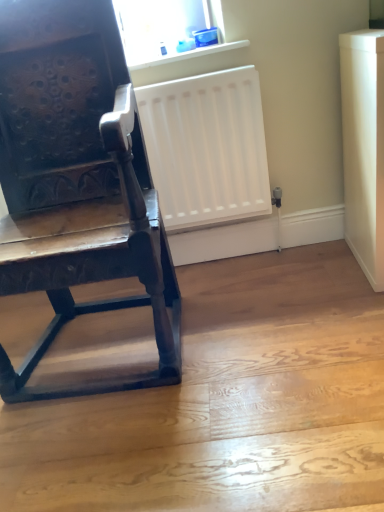
Describe the element at coordinates (190, 54) in the screenshot. I see `white plastic window sill at upper center` at that location.

Where is `white plastic window sill at upper center`? white plastic window sill at upper center is located at coordinates (190, 54).

At what (x,y) coordinates should I click in order to perform the action: click on dark wood chair at left. Please return your answer as a coordinate pair (x, y). Looking at the image, I should click on (77, 181).

This screenshot has width=384, height=512. I want to click on transparent plastic container at upper center, so click(x=164, y=26).

Is the depth of white plastic window sill at upper center greater than that of transparent plastic container at upper center?

Yes, white plastic window sill at upper center is further from the viewer.

Is white plastic window sill at upper center situated inside transparent plastic container at upper center or outside?

The correct answer is: outside.

Is white plastic window sill at upper center placed right next to transparent plastic container at upper center?

No.

Would you say white plastic window sill at upper center is to the left or to the right of transparent plastic container at upper center in the picture?

Clearly, white plastic window sill at upper center is on the right of transparent plastic container at upper center in the image.

Does point (18, 58) appear closer or farther from the camera than point (218, 13)?

Point (18, 58) appears to be closer to the viewer than point (218, 13).

From the image's perspective, is dark wood chair at left under transparent plastic container at upper center?

Yes.

Consider the image. How different are the orientations of dark wood chair at left and transparent plastic container at upper center in degrees?

They differ by 4.69 degrees in their facing directions.

In the scene shown: Is dark wood chair at left positioned behind transparent plastic container at upper center?

No, dark wood chair at left is in front of transparent plastic container at upper center.

Is transparent plastic container at upper center looking in the opposite direction of dark wood chair at left?

No.

Which is nearer, (146, 57) or (101, 51)?

Point (146, 57) is positioned farther from the camera compared to point (101, 51).

Considering the relative sizes of transparent plastic container at upper center and dark wood chair at left in the image provided, is transparent plastic container at upper center smaller than dark wood chair at left?

Indeed, transparent plastic container at upper center has a smaller size compared to dark wood chair at left.

Would you say white plastic window sill at upper center is a long distance from dark wood chair at left?

white plastic window sill at upper center is actually quite close to dark wood chair at left.

Consider the image. Choose the correct answer: Is white plastic window sill at upper center inside dark wood chair at left or outside it?

white plastic window sill at upper center is located beyond the bounds of dark wood chair at left.

From the image's perspective, which is above, white plastic window sill at upper center or dark wood chair at left?

white plastic window sill at upper center.

Is dark wood chair at left in front of or behind white plastic window sill at upper center in the image?

In the image, dark wood chair at left appears in front of white plastic window sill at upper center.

Who is shorter, dark wood chair at left or white plastic window sill at upper center?

With less height is white plastic window sill at upper center.

Is dark wood chair at left at the left side of white plastic window sill at upper center?

Yes.

Based on the photo, does transparent plastic container at upper center turn towards white plastic window sill at upper center?

No, transparent plastic container at upper center is not turned towards white plastic window sill at upper center.

Considering the points (145, 27) and (173, 58), which point is in front, point (145, 27) or point (173, 58)?

The point (173, 58) is in front.

Considering their positions, is transparent plastic container at upper center located in front of or behind white plastic window sill at upper center?

In the image, transparent plastic container at upper center appears in front of white plastic window sill at upper center.

From a real-world perspective, is transparent plastic container at upper center located higher than white plastic window sill at upper center?

Yes.

Locate an element on the screen. The height and width of the screenshot is (512, 384). window sill that is on the right side of transparent plastic container at upper center is located at coordinates (190, 54).

The image size is (384, 512). I want to click on window screen above the dark wood chair at left (from the image's perspective), so click(x=164, y=26).

Based on their spatial positions, is white plastic window sill at upper center or transparent plastic container at upper center further from dark wood chair at left?

Among the two, white plastic window sill at upper center is located further to dark wood chair at left.

Which object lies nearer to the anchor point white plastic window sill at upper center, dark wood chair at left or transparent plastic container at upper center?

Based on the image, transparent plastic container at upper center appears to be nearer to white plastic window sill at upper center.

Based on their spatial positions, is transparent plastic container at upper center or dark wood chair at left closer to white plastic window sill at upper center?

transparent plastic container at upper center.

Looking at the image, which one is located closer to transparent plastic container at upper center, dark wood chair at left or white plastic window sill at upper center?

white plastic window sill at upper center is positioned closer to the anchor transparent plastic container at upper center.

When comparing their distances from dark wood chair at left, does transparent plastic container at upper center or white plastic window sill at upper center seem closer?

Among the two, transparent plastic container at upper center is located nearer to dark wood chair at left.

Based on the photo, estimate the real-world distances between objects in this image. Which object is further from transparent plastic container at upper center, white plastic window sill at upper center or dark wood chair at left?

dark wood chair at left lies further to transparent plastic container at upper center than the other object.

I want to click on window screen located between dark wood chair at left and white plastic window sill at upper center in the depth direction, so click(164, 26).